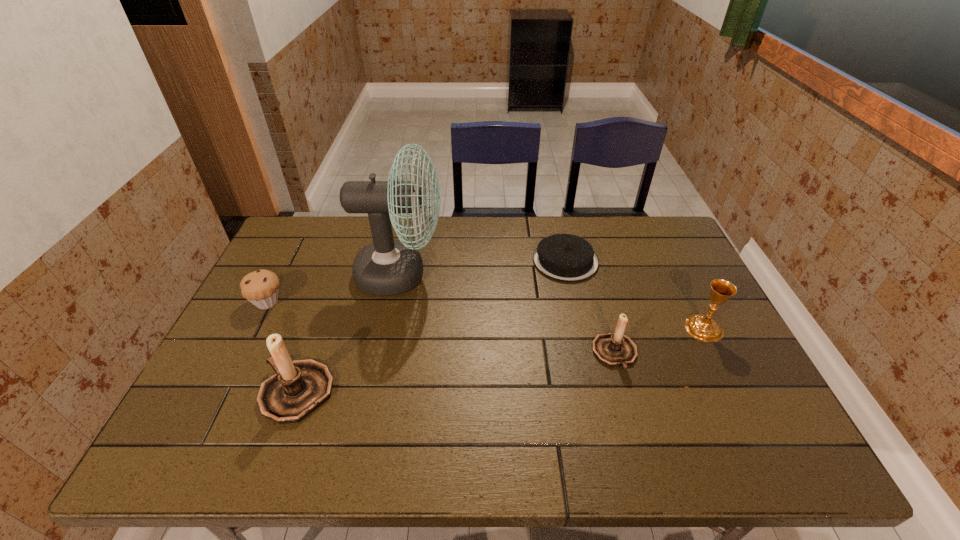
This screenshot has width=960, height=540. Identify the location of vacant area located in front of the fan where the airflow is directed. (496, 274).

Locate an element on the screen. The width and height of the screenshot is (960, 540). vacant space located 0.140m on the front of the muffin is located at coordinates point(240,355).

Find the location of a particular element. vacant area located 0.140m on the back of the pancake is located at coordinates (556, 218).

In order to click on free space located 0.330m on the back of the rightmost object in this screenshot , I will do `click(661, 243)`.

Where is `fan located at the far edge`? fan located at the far edge is located at coordinates (386, 267).

I want to click on pancake located at the far edge, so click(562, 257).

Identify the location of object that is at the near edge. (299, 387).

Locate an element on the screen. Image resolution: width=960 pixels, height=540 pixels. candle holder that is at the left edge is located at coordinates (299, 387).

Find the location of a particular element. muffin present at the left edge is located at coordinates (260, 287).

The image size is (960, 540). Find the location of `object that is at the right edge`. object that is at the right edge is located at coordinates (704, 328).